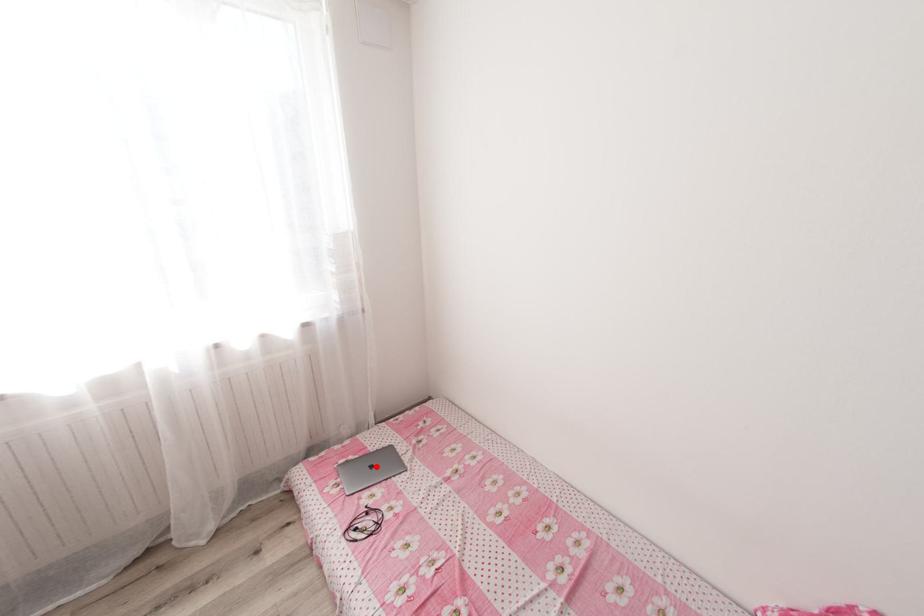
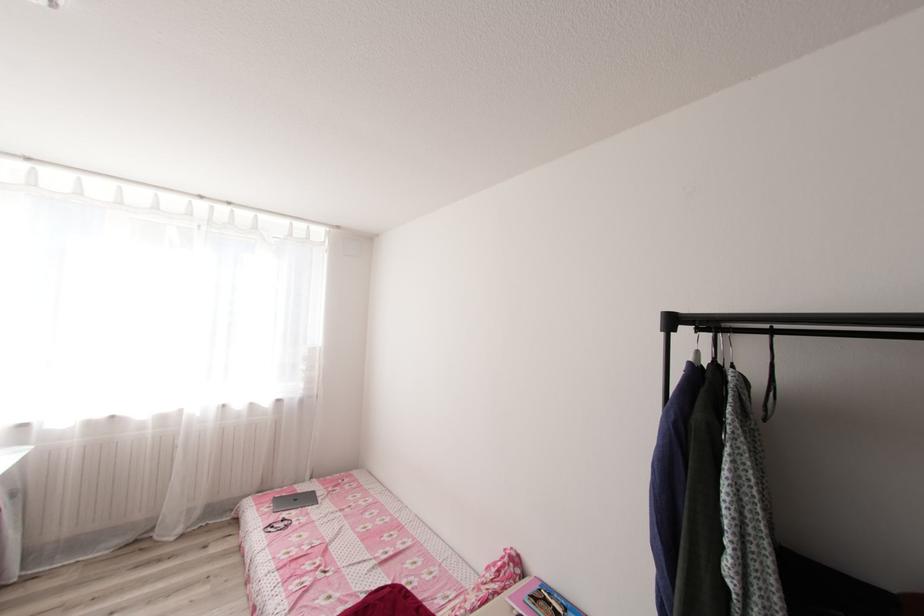
Question: I am providing you with two images of the same scene from different viewpoints. A red point is marked on the first image. At the location where the point appears in image 1, is it still visible in image 2?

Choices:
 (A) Yes
 (B) No

Answer: (A)